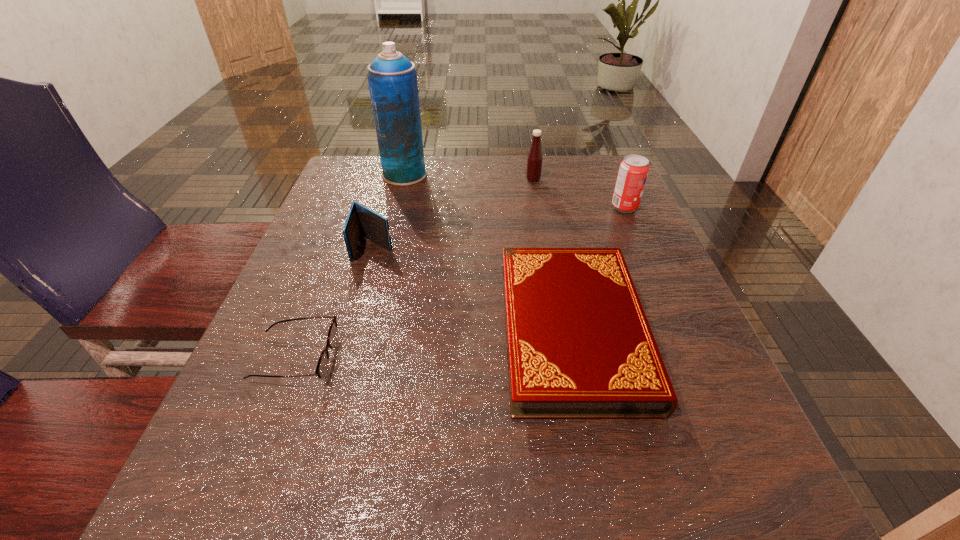
The width and height of the screenshot is (960, 540). Find the location of `blank region between the aerosol can and the hardback book`. blank region between the aerosol can and the hardback book is located at coordinates (489, 253).

Where is `vacant point located between the hardback book and the wallet`? vacant point located between the hardback book and the wallet is located at coordinates (473, 289).

What are the coordinates of `vacant area between the aerosol can and the Tabasco sauce` in the screenshot? It's located at tap(468, 177).

You are a GUI agent. You are given a task and a screenshot of the screen. Output one action in this format:
    pyautogui.click(x=<x>, y=<y>)
    Task: Click on the empty space that is in between the wallet and the Tabasco sauce
    
    Given the screenshot: What is the action you would take?
    pyautogui.click(x=454, y=213)

You are a GUI agent. You are given a task and a screenshot of the screen. Output one action in this format:
    pyautogui.click(x=<x>, y=<y>)
    Task: Click on the vacant point located between the spectacles and the soda can
    The height and width of the screenshot is (540, 960).
    Given the screenshot: What is the action you would take?
    pyautogui.click(x=460, y=282)

The width and height of the screenshot is (960, 540). Find the location of `unoccupied position between the third nearest object and the tallest object`. unoccupied position between the third nearest object and the tallest object is located at coordinates [390, 211].

At what (x,y) coordinates should I click in order to perform the action: click on vacant area that lies between the tallest object and the wallet. Please return your answer as a coordinate pair (x, y). Looking at the image, I should click on (390, 211).

This screenshot has height=540, width=960. What are the coordinates of `object that stands as the closest to the rightmost object` in the screenshot? It's located at (534, 160).

Choose which object is the fourth nearest neighbor to the hardback book. Please provide its 2D coordinates. Your answer should be formatted as a tuple, i.e. [(x, y)], where the tuple contains the x and y coordinates of a point satisfying the conditions above.

[(534, 160)]

You are a GUI agent. You are given a task and a screenshot of the screen. Output one action in this format:
    pyautogui.click(x=<x>, y=<y>)
    Task: Click on the free region that satisfies the following two spatial constraints: 1. on the exterior surface of the third nearest object; 2. on the face of the spectacles
    
    Given the screenshot: What is the action you would take?
    pyautogui.click(x=343, y=358)